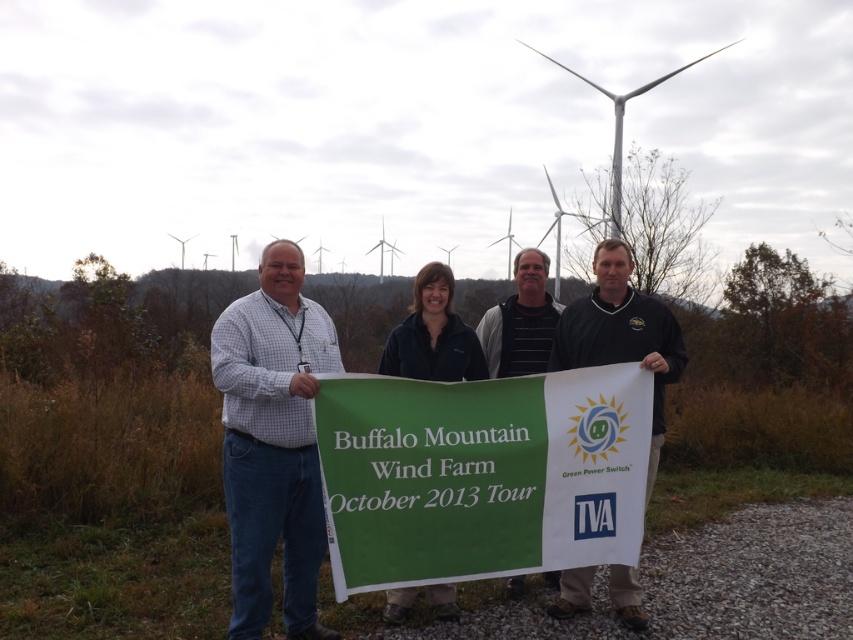
Question: Does checkered shirt at left appear over black fabric at center?

Choices:
 (A) yes
 (B) no

Answer: (B)

Question: Among these points, which one is nearest to the camera?

Choices:
 (A) (535, 257)
 (B) (421, 541)
 (C) (602, 250)
 (D) (334, 333)

Answer: (B)

Question: Is checkered shirt at left above black fabric at center?

Choices:
 (A) yes
 (B) no

Answer: (B)

Question: Can you confirm if checkered shirt at left is positioned above striped sweater at center?

Choices:
 (A) no
 (B) yes

Answer: (A)

Question: Which point is farther from the camera taking this photo?

Choices:
 (A) (270, 353)
 (B) (526, 301)
 (C) (461, 449)

Answer: (B)

Question: Which object is positioned farthest from the green paper banner at center?

Choices:
 (A) checkered shirt at left
 (B) striped sweater at center

Answer: (B)